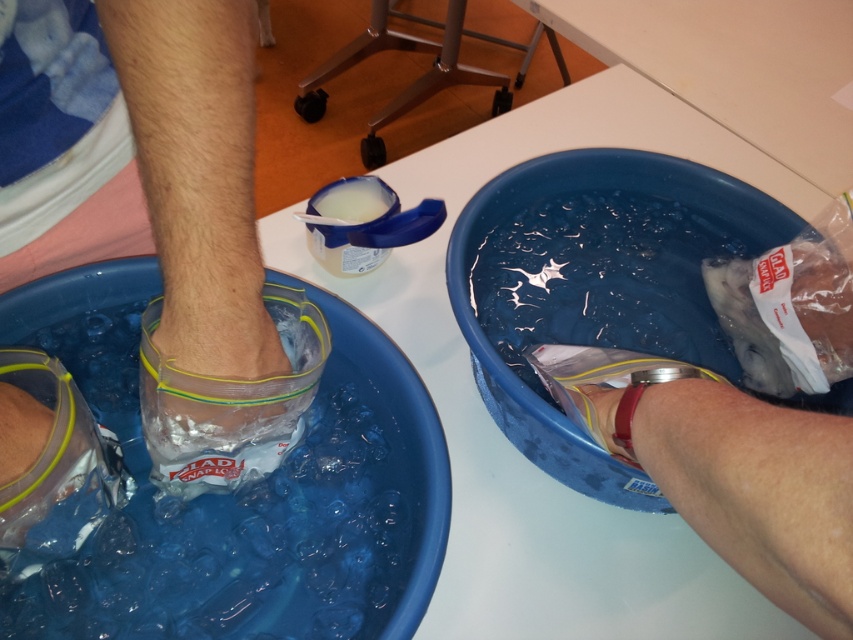
Question: Can you confirm if blue plastic basin at center is smaller than clear plastic bag at lower left?

Choices:
 (A) yes
 (B) no

Answer: (B)

Question: Among these points, which one is farthest from the camera?

Choices:
 (A) (810, 605)
 (B) (160, 369)

Answer: (B)

Question: Based on their relative distances, which object is nearer to the clear plastic bag at lower left?

Choices:
 (A) translucent plastic basin at lower left
 (B) smooth white arm at lower right

Answer: (A)

Question: Can you confirm if blue plastic basin at center is thinner than smooth white arm at lower right?

Choices:
 (A) yes
 (B) no

Answer: (B)

Question: Is translucent plastic basin at lower left to the left of blue plastic basin at center from the viewer's perspective?

Choices:
 (A) yes
 (B) no

Answer: (A)

Question: Estimate the real-world distances between objects in this image. Which object is farther from the smooth white arm at lower right?

Choices:
 (A) clear plastic bag at lower left
 (B) blue plastic basin at center
 (C) translucent plastic basin at lower left

Answer: (C)